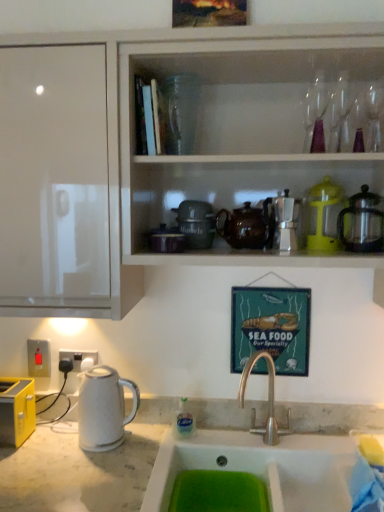
The width and height of the screenshot is (384, 512). What are the coordinates of `white glossy cabinet at upper center` in the screenshot? It's located at (173, 152).

This screenshot has height=512, width=384. What do you see at coordinates (173, 152) in the screenshot? I see `white glossy cabinet at upper center` at bounding box center [173, 152].

How much space does satin silver coffee pot at upper right, which is the 3th appliance in left-to-right order, occupy vertically?

satin silver coffee pot at upper right, which is the 3th appliance in left-to-right order, is 8.79 inches tall.

This screenshot has height=512, width=384. I want to click on white plastic electric outlet at lower left, acting as the 1th electric outlet starting from the right, so (x=78, y=365).

Describe the element at coordinates (324, 215) in the screenshot. This screenshot has height=512, width=384. I see `yellow translucent jug at upper right, which is the second appliance in right-to-left order` at that location.

Where is `white glossy cabinet at upper center`? The height and width of the screenshot is (512, 384). white glossy cabinet at upper center is located at coordinates (173, 152).

This screenshot has height=512, width=384. In order to click on electric outlet that is the 1st one when counting downward from the white glossy cabinet at upper center (from the image's perspective) in this screenshot , I will do click(39, 358).

Would you consider red plastic switch at lower left, which is counted as the 2th electric outlet, starting from the right, to be distant from white glossy cabinet at upper center?

They are positioned close to each other.

How many degrees apart are the facing directions of red plastic switch at lower left, which is counted as the 2th electric outlet, starting from the right, and white glossy cabinet at upper center?

There is a 1.13-degree angle between the facing directions of red plastic switch at lower left, which is counted as the 2th electric outlet, starting from the right, and white glossy cabinet at upper center.

Is white glossy cabinet at upper center inside red plastic switch at lower left, placed as the first electric outlet when sorted from left to right?

No, white glossy cabinet at upper center is not surrounded by red plastic switch at lower left, placed as the first electric outlet when sorted from left to right.

How many degrees apart are the facing directions of white glossy cabinet at upper center and white plastic electric outlet at lower left, acting as the 1th electric outlet starting from the right?

0.581 degrees.

Could white plastic electric outlet at lower left, which is the second electric outlet from left to right, be considered to be inside white glossy cabinet at upper center?

Actually, white plastic electric outlet at lower left, which is the second electric outlet from left to right, is outside white glossy cabinet at upper center.

Is white glossy cabinet at upper center facing away from white plastic electric outlet at lower left, acting as the 1th electric outlet starting from the right?

That's not correct — white glossy cabinet at upper center is not looking away from white plastic electric outlet at lower left, acting as the 1th electric outlet starting from the right.

Which is behind, point (156, 33) or point (89, 351)?

The point (89, 351) is behind.

From a real-world perspective, between yellow translucent jug at upper right, placed as the 2th appliance when sorted from left to right, and metallic silver coffee maker at upper center, arranged as the 3th appliance when viewed from the right, who is vertically lower?

From a 3D spatial view, metallic silver coffee maker at upper center, arranged as the 3th appliance when viewed from the right, is below.

Considering the relative positions of yellow translucent jug at upper right, placed as the 2th appliance when sorted from left to right, and metallic silver coffee maker at upper center, arranged as the 3th appliance when viewed from the right, in the image provided, is yellow translucent jug at upper right, placed as the 2th appliance when sorted from left to right, to the right of metallic silver coffee maker at upper center, arranged as the 3th appliance when viewed from the right, from the viewer's perspective?

Indeed, yellow translucent jug at upper right, placed as the 2th appliance when sorted from left to right, is positioned on the right side of metallic silver coffee maker at upper center, arranged as the 3th appliance when viewed from the right.

How different are the orientations of yellow translucent jug at upper right, which is the second appliance in right-to-left order, and metallic silver coffee maker at upper center, the first appliance when ordered from left to right, in degrees?

0.00149 degrees.

Can you confirm if yellow translucent jug at upper right, placed as the 2th appliance when sorted from left to right, is bigger than metallic silver coffee maker at upper center, arranged as the 3th appliance when viewed from the right?

Correct, yellow translucent jug at upper right, placed as the 2th appliance when sorted from left to right, is larger in size than metallic silver coffee maker at upper center, arranged as the 3th appliance when viewed from the right.

Based on the photo, is white glossy cabinet at upper center next to metallic silver coffee maker at upper center, the first appliance when ordered from left to right?

No.

In terms of size, does white glossy cabinet at upper center appear bigger or smaller than metallic silver coffee maker at upper center, arranged as the 3th appliance when viewed from the right?

Considering their sizes, white glossy cabinet at upper center takes up more space than metallic silver coffee maker at upper center, arranged as the 3th appliance when viewed from the right.

The width and height of the screenshot is (384, 512). Identify the location of cabinetry above the metallic silver coffee maker at upper center, arranged as the 3th appliance when viewed from the right (from the image's perspective). (173, 152).

Which is in front, point (77, 203) or point (275, 232)?

The point (77, 203) is more forward.

From the image's perspective, is white plastic electric outlet at lower left, which is the second electric outlet from left to right, below white glossy cabinet at upper center?

Correct, white plastic electric outlet at lower left, which is the second electric outlet from left to right, appears lower than white glossy cabinet at upper center in the image.

The image size is (384, 512). Identify the location of cabinetry on the right of the white plastic electric outlet at lower left, which is the second electric outlet from left to right. (173, 152).

Between white plastic electric outlet at lower left, acting as the 1th electric outlet starting from the right, and white glossy cabinet at upper center, which one appears on the right side from the viewer's perspective?

From the viewer's perspective, white glossy cabinet at upper center appears more on the right side.

Is metallic silver coffee maker at upper center, the first appliance when ordered from left to right, facing away from white glossy cabinet at upper center?

Yes.

The height and width of the screenshot is (512, 384). I want to click on the 1st appliance to the right of the white glossy cabinet at upper center, counting from the anchor's position, so click(285, 222).

Are metallic silver coffee maker at upper center, arranged as the 3th appliance when viewed from the right, and white glossy cabinet at upper center beside each other?

No, metallic silver coffee maker at upper center, arranged as the 3th appliance when viewed from the right, is not beside white glossy cabinet at upper center.

From the picture: Can you tell me how much metallic silver coffee maker at upper center, the first appliance when ordered from left to right, and white glossy cabinet at upper center differ in facing direction?

0.0656 degrees separate the facing orientations of metallic silver coffee maker at upper center, the first appliance when ordered from left to right, and white glossy cabinet at upper center.

Is metallic silver coffee maker at upper center, arranged as the 3th appliance when viewed from the right, completely or partially outside of yellow translucent jug at upper right, which is the second appliance in right-to-left order?

metallic silver coffee maker at upper center, arranged as the 3th appliance when viewed from the right, is positioned outside yellow translucent jug at upper right, which is the second appliance in right-to-left order.

Is metallic silver coffee maker at upper center, arranged as the 3th appliance when viewed from the right, at the left side of yellow translucent jug at upper right, placed as the 2th appliance when sorted from left to right?

Yes, metallic silver coffee maker at upper center, arranged as the 3th appliance when viewed from the right, is to the left of yellow translucent jug at upper right, placed as the 2th appliance when sorted from left to right.

Image resolution: width=384 pixels, height=512 pixels. In order to click on the 1st electric outlet positioned below the white glossy cabinet at upper center (from a real-world perspective) in this screenshot , I will do `click(39, 358)`.

I want to click on cabinetry above the white plastic electric outlet at lower left, acting as the 1th electric outlet starting from the right (from the image's perspective), so click(173, 152).

Which object lies further to the anchor point white glossy electric kettle at left, metallic signboard at center or metallic silver coffee maker at upper center, the first appliance when ordered from left to right?

The object further to white glossy electric kettle at left is metallic silver coffee maker at upper center, the first appliance when ordered from left to right.

Which object lies further to the anchor point white glossy electric kettle at left, red plastic switch at lower left, which is counted as the 2th electric outlet, starting from the right, or metallic silver coffee maker at upper center, arranged as the 3th appliance when viewed from the right?

Based on the image, metallic silver coffee maker at upper center, arranged as the 3th appliance when viewed from the right, appears to be further to white glossy electric kettle at left.

Based on their spatial positions, is white glossy electric kettle at left or yellow translucent jug at upper right, placed as the 2th appliance when sorted from left to right, further from satin silver coffee pot at upper right, which is the 3th appliance in left-to-right order?

The object further to satin silver coffee pot at upper right, which is the 3th appliance in left-to-right order, is white glossy electric kettle at left.

Considering their positions, is metallic silver coffee maker at upper center, arranged as the 3th appliance when viewed from the right, positioned closer to yellow translucent jug at upper right, placed as the 2th appliance when sorted from left to right, than white plastic electric outlet at lower left, which is the second electric outlet from left to right?

metallic silver coffee maker at upper center, arranged as the 3th appliance when viewed from the right, is positioned closer to the anchor yellow translucent jug at upper right, placed as the 2th appliance when sorted from left to right.

Estimate the real-world distances between objects in this image. Which object is further from white glossy cabinet at upper center, yellow translucent jug at upper right, placed as the 2th appliance when sorted from left to right, or satin silver coffee pot at upper right, which is the 3th appliance in left-to-right order?

Among the two, satin silver coffee pot at upper right, which is the 3th appliance in left-to-right order, is located further to white glossy cabinet at upper center.

Considering their positions, is metallic silver coffee maker at upper center, arranged as the 3th appliance when viewed from the right, positioned closer to metallic signboard at center than white glossy electric kettle at left?

metallic silver coffee maker at upper center, arranged as the 3th appliance when viewed from the right, is positioned closer to the anchor metallic signboard at center.

Looking at the image, which one is located closer to red plastic switch at lower left, placed as the first electric outlet when sorted from left to right, yellow translucent jug at upper right, placed as the 2th appliance when sorted from left to right, or white glossy cabinet at upper center?

Among the two, white glossy cabinet at upper center is located nearer to red plastic switch at lower left, placed as the first electric outlet when sorted from left to right.

Based on their spatial positions, is yellow translucent jug at upper right, which is the second appliance in right-to-left order, or red plastic switch at lower left, which is counted as the 2th electric outlet, starting from the right, further from white plastic electric outlet at lower left, which is the second electric outlet from left to right?

yellow translucent jug at upper right, which is the second appliance in right-to-left order, is positioned further to the anchor white plastic electric outlet at lower left, which is the second electric outlet from left to right.

Identify the location of appliance between red plastic switch at lower left, placed as the first electric outlet when sorted from left to right, and yellow translucent jug at upper right, which is the second appliance in right-to-left order. (285, 222).

You are a GUI agent. You are given a task and a screenshot of the screen. Output one action in this format:
    pyautogui.click(x=<x>, y=<y>)
    Task: Click on the picture frame between white glossy cabinet at upper center and satin silver coffee pot at upper right, which is the 3th appliance in left-to-right order
    
    Given the screenshot: What is the action you would take?
    pyautogui.click(x=271, y=327)

The image size is (384, 512). Find the location of `kitchen appliance between red plastic switch at lower left, placed as the first electric outlet when sorted from left to right, and metallic signboard at center`. kitchen appliance between red plastic switch at lower left, placed as the first electric outlet when sorted from left to right, and metallic signboard at center is located at coordinates (104, 408).

Find the location of a particular element. The image size is (384, 512). electric outlet between red plastic switch at lower left, placed as the first electric outlet when sorted from left to right, and yellow translucent jug at upper right, which is the second appliance in right-to-left order, in the horizontal direction is located at coordinates (78, 365).